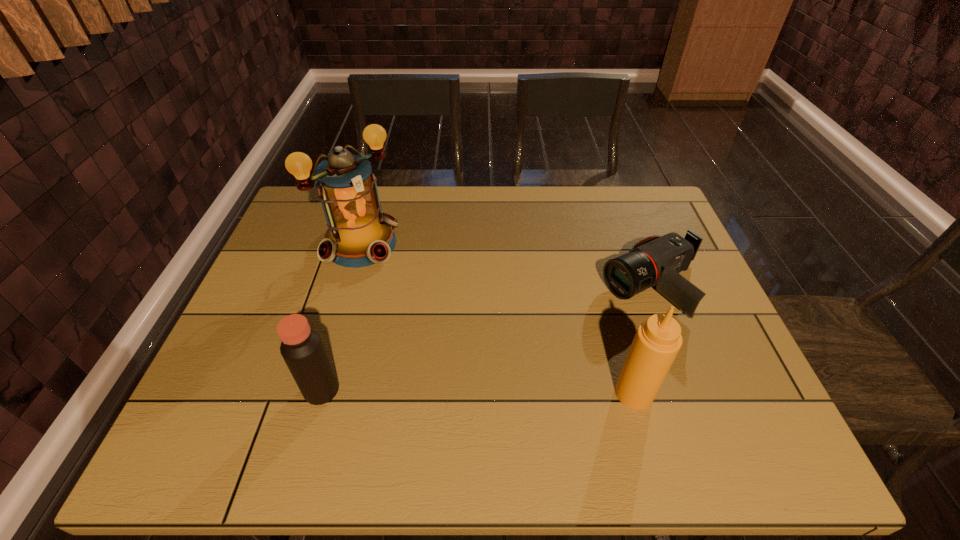
Locate an element on the screen. vacant area at the left edge is located at coordinates (295, 238).

Image resolution: width=960 pixels, height=540 pixels. In the image, there is a desktop. What are the coordinates of `vacant space at the right edge` in the screenshot? It's located at (704, 328).

The height and width of the screenshot is (540, 960). I want to click on free location at the far right corner of the desktop, so pyautogui.click(x=642, y=217).

The image size is (960, 540). What are the coordinates of `free space between the condiment and the lantern` in the screenshot? It's located at (497, 319).

The width and height of the screenshot is (960, 540). I want to click on free spot between the tallest object and the vinegar, so click(342, 317).

You are a GUI agent. You are given a task and a screenshot of the screen. Output one action in this format:
    pyautogui.click(x=<x>, y=<y>)
    Task: Click on the vacant space in between the second tallest object and the tallest object
    This screenshot has height=540, width=960.
    Given the screenshot: What is the action you would take?
    pyautogui.click(x=497, y=319)

The height and width of the screenshot is (540, 960). Identify the location of blank region between the third shortest object and the lantern. (497, 319).

Identify the location of unoccupied position between the shortest object and the tallest object. The width and height of the screenshot is (960, 540). 507,265.

Identify the location of vacant area that lies between the lantern and the camcorder. (507, 265).

Locate an element on the screen. The image size is (960, 540). blank region between the condiment and the tallest object is located at coordinates (497, 319).